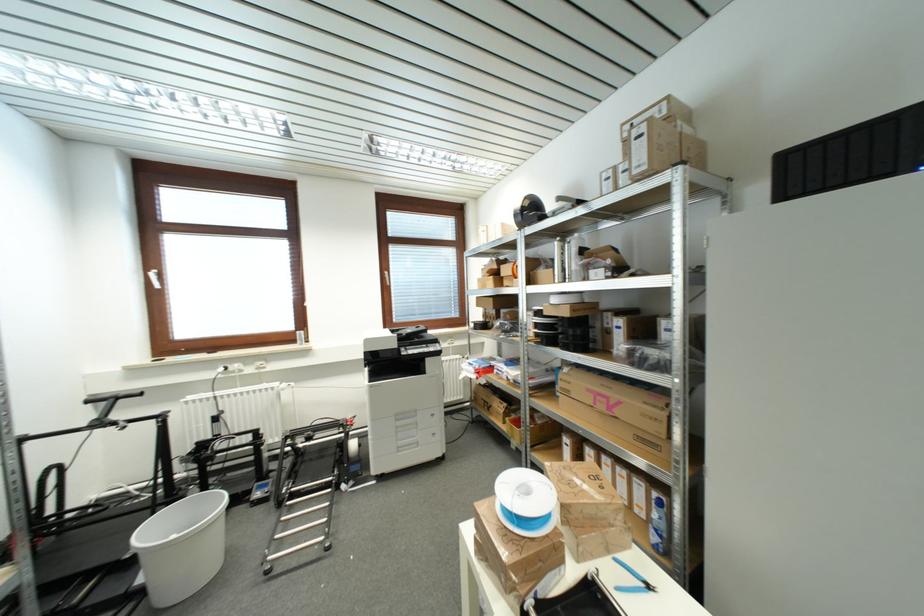
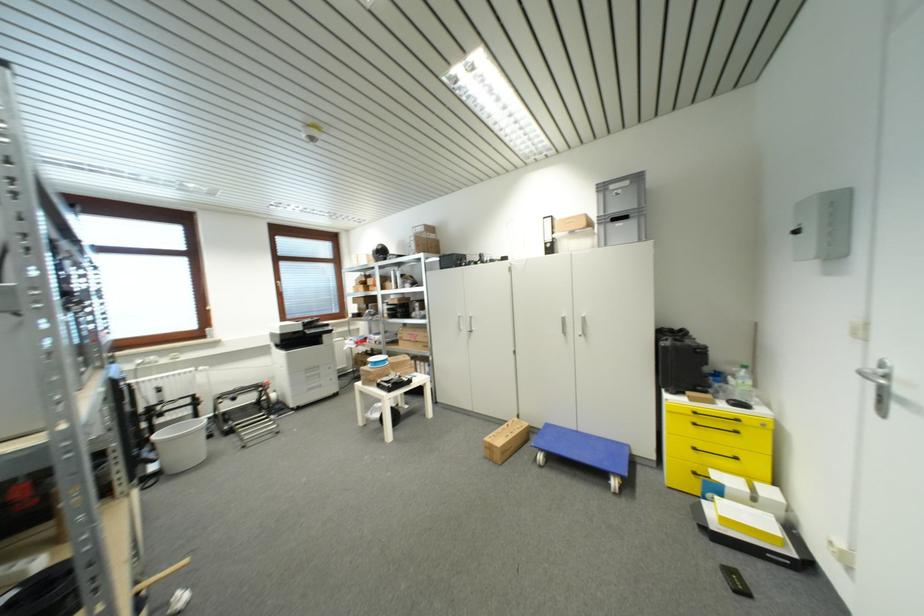
Question: I am providing you with two images of the same scene from different viewpoints. Please identify which objects are invisible in image2.

Choices:
 (A) black ring
 (B) printer top cover
 (C) blue wheeled dolly
 (D) blue handle pliers

Answer: (D)